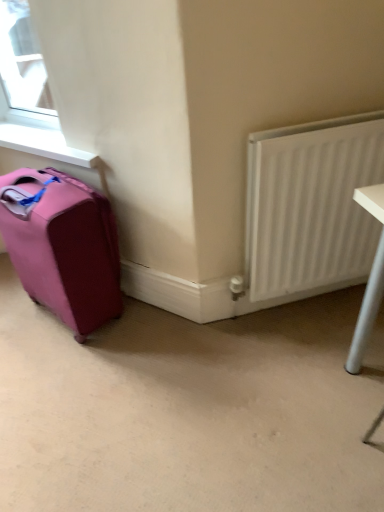
Question: Is point (342, 259) closer or farther from the camera than point (34, 139)?

Choices:
 (A) closer
 (B) farther

Answer: (A)

Question: Considering the relative positions of white textured radiator at right and white smooth window sill at upper left in the image provided, is white textured radiator at right to the left or to the right of white smooth window sill at upper left?

Choices:
 (A) right
 (B) left

Answer: (A)

Question: Which of these objects is positioned closest to the beige carpet at lower center?

Choices:
 (A) white textured radiator at right
 (B) white smooth window sill at upper left
 (C) pink fabric suitcase at left

Answer: (C)

Question: Which object is positioned farthest from the beige carpet at lower center?

Choices:
 (A) pink fabric suitcase at left
 (B) white smooth window sill at upper left
 (C) white textured radiator at right

Answer: (B)